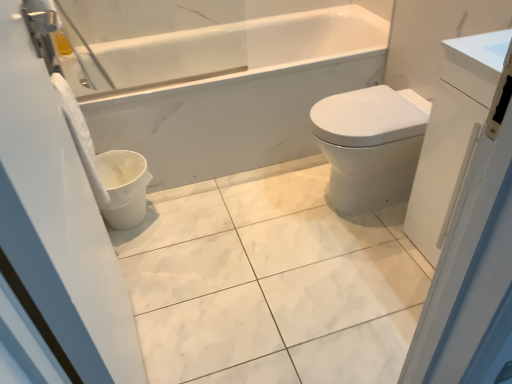
Find the location of `vacant space to the right of white glossy toilet bowl at lower left`. vacant space to the right of white glossy toilet bowl at lower left is located at coordinates (185, 212).